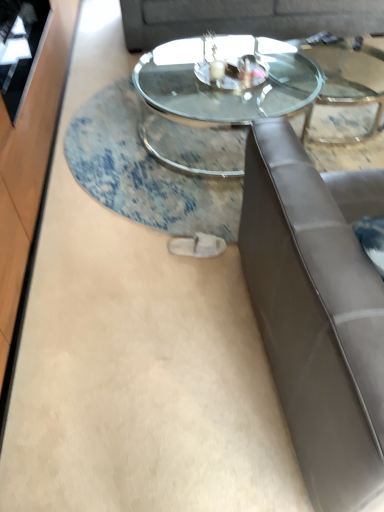
Describe the element at coordinates (224, 85) in the screenshot. I see `transparent glass coffee table at center` at that location.

Describe the element at coordinates (246, 19) in the screenshot. This screenshot has height=512, width=384. I see `suede gray couch at upper center` at that location.

At what (x,y) coordinates should I click in order to perform the action: click on transparent glass coffee table at center. Please return your answer as a coordinate pair (x, y). This screenshot has width=384, height=512. Looking at the image, I should click on (224, 85).

Is transparent glass coffee table at center facing away from suede gray couch at upper center?

transparent glass coffee table at center does not have its back to suede gray couch at upper center.

From their relative heights in the image, would you say transparent glass coffee table at center is taller or shorter than suede gray couch at upper center?

Considering their sizes, transparent glass coffee table at center has less height than suede gray couch at upper center.

Would you say suede gray couch at upper center is part of transparent glass coffee table at center's contents?

No, suede gray couch at upper center is not a part of transparent glass coffee table at center.

Could transparent glass coffee table at center be considered to be inside satin brown leather studio couch at right?

No, transparent glass coffee table at center is located outside of satin brown leather studio couch at right.

Does point (345, 501) come behind point (271, 54)?

No, it is not.

In terms of width, does satin brown leather studio couch at right look wider or thinner when compared to transparent glass coffee table at center?

satin brown leather studio couch at right is thinner than transparent glass coffee table at center.

Is the depth of satin brown leather studio couch at right greater than that of transparent glass coffee table at center?

No, the depth of satin brown leather studio couch at right is less than that of transparent glass coffee table at center.

I want to click on glass door lying in front of the transparent glass coffee table at center, so click(x=20, y=48).

What's the angular difference between transparent glass coffee table at center and transparent glass door at left's facing directions?

There is a 178-degree angle between the facing directions of transparent glass coffee table at center and transparent glass door at left.

Is transparent glass coffee table at center facing towards transparent glass door at left?

No, transparent glass coffee table at center is not oriented towards transparent glass door at left.

Is transparent glass coffee table at center not near transparent glass door at left?

transparent glass coffee table at center is far away from transparent glass door at left.

Looking at this image, is suede gray couch at upper center oriented towards transparent glass coffee table at center?

Yes, suede gray couch at upper center is aimed at transparent glass coffee table at center.

Looking at this image, can you see suede gray couch at upper center touching transparent glass coffee table at center?

No, suede gray couch at upper center is not beside transparent glass coffee table at center.

Considering the sizes of objects suede gray couch at upper center and transparent glass coffee table at center in the image provided, who is bigger, suede gray couch at upper center or transparent glass coffee table at center?

suede gray couch at upper center is bigger.

Which object is further away from the camera, suede gray couch at upper center or transparent glass coffee table at center?

suede gray couch at upper center is behind.

Is satin brown leather studio couch at right taller or shorter than transparent glass door at left?

Clearly, satin brown leather studio couch at right is taller compared to transparent glass door at left.

Relative to transparent glass door at left, is satin brown leather studio couch at right in front or behind?

Clearly, satin brown leather studio couch at right is in front of transparent glass door at left.

This screenshot has height=512, width=384. I want to click on glass door above the satin brown leather studio couch at right (from a real-world perspective), so click(x=20, y=48).

Which of these two, satin brown leather studio couch at right or transparent glass door at left, is bigger?

With larger size is satin brown leather studio couch at right.

Is point (193, 67) farther from camera compared to point (347, 336)?

Yes, point (193, 67) is farther from viewer.

Is transparent glass coffee table at center in contact with satin brown leather studio couch at right?

There is a gap between transparent glass coffee table at center and satin brown leather studio couch at right.

Considering the sizes of objects transparent glass coffee table at center and satin brown leather studio couch at right in the image provided, who is wider, transparent glass coffee table at center or satin brown leather studio couch at right?

With larger width is transparent glass coffee table at center.

Is satin brown leather studio couch at right a part of transparent glass coffee table at center?

No, satin brown leather studio couch at right is located outside of transparent glass coffee table at center.

Which is correct: transparent glass door at left is inside suede gray couch at upper center, or outside of it?

transparent glass door at left is not enclosed by suede gray couch at upper center.

Considering the relative sizes of transparent glass door at left and suede gray couch at upper center in the image provided, is transparent glass door at left shorter than suede gray couch at upper center?

Indeed, transparent glass door at left has a lesser height compared to suede gray couch at upper center.

Is transparent glass door at left positioned far away from suede gray couch at upper center?

transparent glass door at left is far away from suede gray couch at upper center.

Where is `couch behind the transparent glass coffee table at center`? couch behind the transparent glass coffee table at center is located at coordinates (246, 19).

Where is `coffee table that appears above the satin brown leather studio couch at right (from the image's perspective)`? This screenshot has width=384, height=512. coffee table that appears above the satin brown leather studio couch at right (from the image's perspective) is located at coordinates tap(224, 85).

Which object lies nearer to the anchor point satin brown leather studio couch at right, transparent glass door at left or transparent glass coffee table at center?

transparent glass coffee table at center lies closer to satin brown leather studio couch at right than the other object.

When comparing their distances from transparent glass coffee table at center, does transparent glass door at left or satin brown leather studio couch at right seem closer?

transparent glass door at left lies closer to transparent glass coffee table at center than the other object.

Estimate the real-world distances between objects in this image. Which object is further from transparent glass door at left, transparent glass coffee table at center or suede gray couch at upper center?

Based on the image, suede gray couch at upper center appears to be further to transparent glass door at left.

Estimate the real-world distances between objects in this image. Which object is further from satin brown leather studio couch at right, transparent glass door at left or suede gray couch at upper center?

suede gray couch at upper center lies further to satin brown leather studio couch at right than the other object.

Which object lies further to the anchor point transparent glass coffee table at center, transparent glass door at left or suede gray couch at upper center?

transparent glass door at left lies further to transparent glass coffee table at center than the other object.

Estimate the real-world distances between objects in this image. Which object is further from transparent glass door at left, transparent glass coffee table at center or satin brown leather studio couch at right?

satin brown leather studio couch at right.

From the image, which object appears to be farther from suede gray couch at upper center, satin brown leather studio couch at right or transparent glass coffee table at center?

satin brown leather studio couch at right lies further to suede gray couch at upper center than the other object.

Based on their spatial positions, is satin brown leather studio couch at right or transparent glass coffee table at center further from transparent glass door at left?

satin brown leather studio couch at right lies further to transparent glass door at left than the other object.

The height and width of the screenshot is (512, 384). I want to click on glass door between satin brown leather studio couch at right and suede gray couch at upper center in the front-back direction, so click(x=20, y=48).

Identify the location of coffee table situated between transparent glass door at left and suede gray couch at upper center from left to right. (224, 85).

You are a GUI agent. You are given a task and a screenshot of the screen. Output one action in this format:
    pyautogui.click(x=<x>, y=<y>)
    Task: Click on the coffee table located between transparent glass door at left and satin brown leather studio couch at right in the left-right direction
    This screenshot has width=384, height=512.
    Given the screenshot: What is the action you would take?
    pyautogui.click(x=224, y=85)

At what (x,y) coordinates should I click in order to perform the action: click on coffee table between satin brown leather studio couch at right and suede gray couch at upper center along the z-axis. Please return your answer as a coordinate pair (x, y). Looking at the image, I should click on (224, 85).